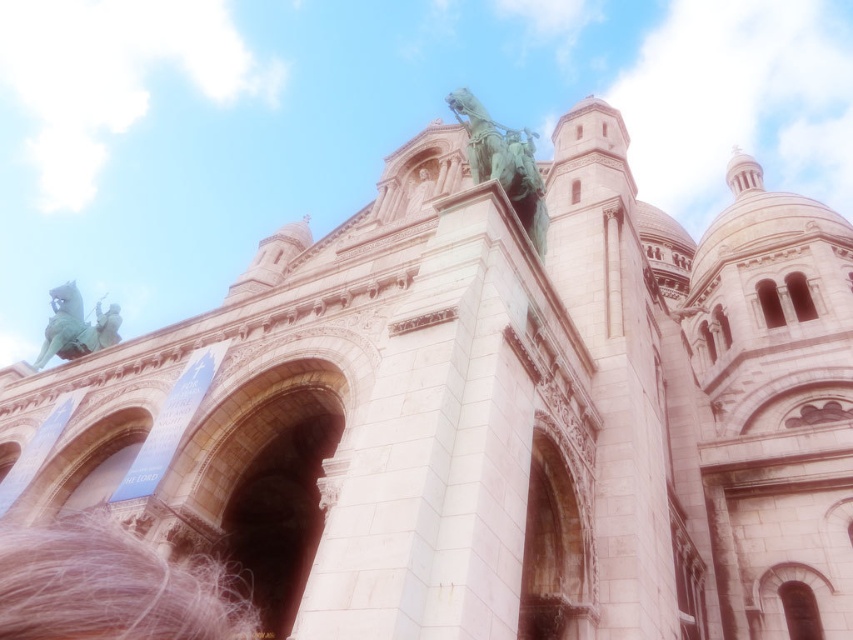
Based on the scene description, where is the pink hair at lower left located in terms of its 2D coordinates?

The pink hair at lower left is located at the 2D coordinates point (111, 586).

You are an art student observing the cathedral facade. You notice the pink hair at lower left and the green patina metal statue at upper center. Which object is located higher on the facade?

The green patina metal statue at upper center is located higher on the facade than the pink hair at lower left.

You are an architect designing a new building and want to incorporate elements from this image. You notice the pink hair at lower left and the green patina statue at upper center. Which element should you choose if you want to feature a wider object in your design?

The pink hair at lower left might be wider than the green patina statue at upper center, so you should choose the pink hair at lower left for a wider feature in your design.